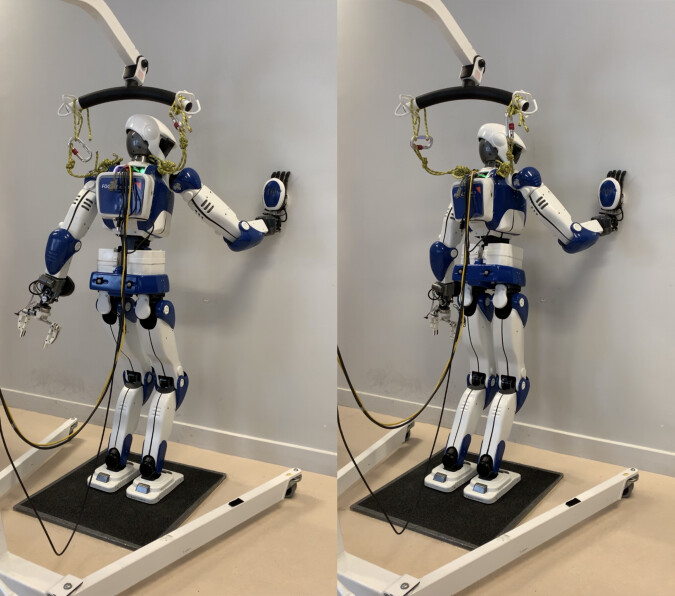
Where is `back wall right side image`? back wall right side image is located at coordinates (572, 155).